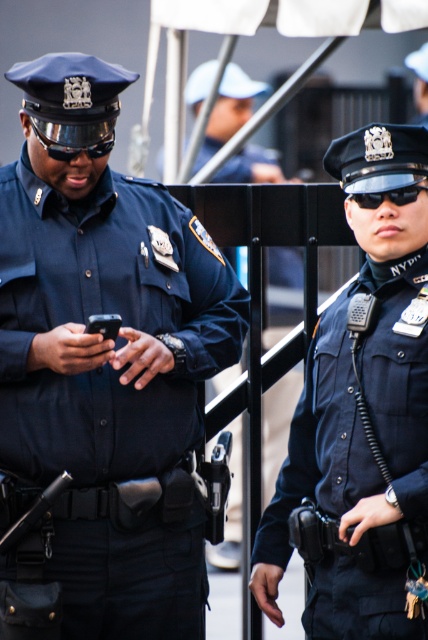
Question: Considering the relative positions of matte blue uniform at left and dark blue uniform at center in the image provided, where is matte blue uniform at left located with respect to dark blue uniform at center?

Choices:
 (A) right
 (B) left

Answer: (B)

Question: Can you confirm if matte blue uniform at left is positioned to the right of navy blue uniform at center?

Choices:
 (A) yes
 (B) no

Answer: (B)

Question: Can you confirm if matte black goggles at left is smaller than black plastic goggles at center?

Choices:
 (A) yes
 (B) no

Answer: (B)

Question: Which of the following is the closest to the observer?

Choices:
 (A) (357, 195)
 (B) (350, 531)

Answer: (B)

Question: Which point appears closest to the camera in this image?

Choices:
 (A) (104, 422)
 (B) (371, 554)
 (C) (412, 192)

Answer: (B)

Question: Among these points, which one is nearest to the camera?

Choices:
 (A) (80, 145)
 (B) (404, 198)
 (C) (389, 132)
 (D) (79, 378)

Answer: (A)